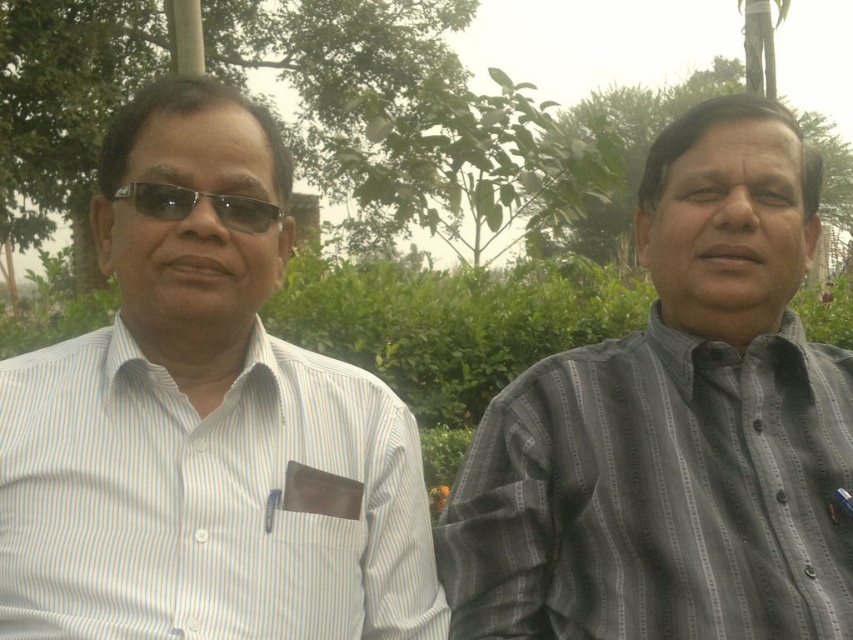
Question: Where is gray striped shirt at right located in relation to white striped shirt at left in the image?

Choices:
 (A) above
 (B) below

Answer: (A)

Question: Which point is farther to the camera?

Choices:
 (A) (45, 620)
 (B) (653, 397)

Answer: (B)

Question: Does white striped shirt at left appear over black plastic glasses at left?

Choices:
 (A) no
 (B) yes

Answer: (A)

Question: Among these objects, which one is farthest from the camera?

Choices:
 (A) white striped shirt at left
 (B) black plastic glasses at left

Answer: (B)

Question: Which object is positioned closest to the gray striped shirt at right?

Choices:
 (A) white striped shirt at left
 (B) black plastic glasses at left

Answer: (A)

Question: From the image, what is the correct spatial relationship of gray striped shirt at right in relation to black plastic glasses at left?

Choices:
 (A) right
 (B) left

Answer: (A)